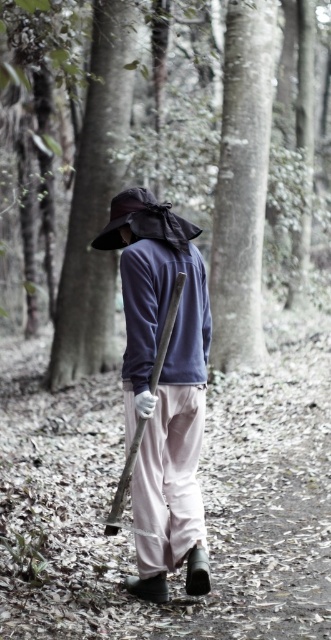
You are a hiker navigating through the forest. You notice a brown textured tree trunk at center located at point (x=94, y=202). If you were to walk directly towards this point, which direction should you head relative to your current position?

The brown textured tree trunk at center is located at point (x=94, y=202), so you should head towards that coordinate to reach it.

You are a hiker who just found a matte black hat at center and a wooden shovel at center in the forest. Which object is positioned higher relative to the ground?

The matte black hat at center is located above the wooden shovel at center, so it is positioned higher relative to the ground.